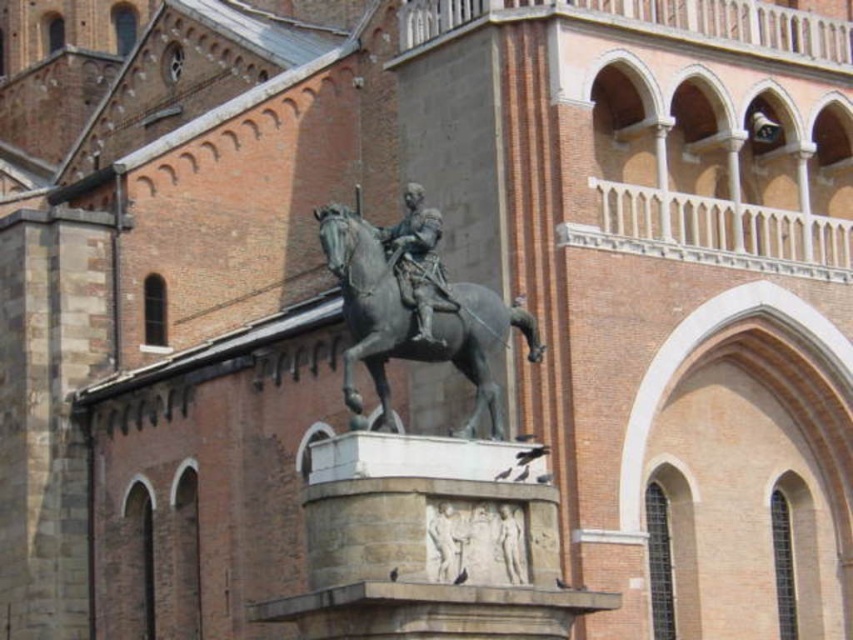
Question: Which object is closer to the camera taking this photo?

Choices:
 (A) polished bronze statue at center
 (B) bronze statue of horse at center

Answer: (B)

Question: Which point is farther to the camera?

Choices:
 (A) bronze statue of horse at center
 (B) polished bronze statue at center

Answer: (B)

Question: Is bronze statue of horse at center below polished bronze statue at center?

Choices:
 (A) yes
 (B) no

Answer: (A)

Question: Among these objects, which one is nearest to the camera?

Choices:
 (A) bronze statue of horse at center
 (B) polished bronze statue at center

Answer: (A)

Question: Can you confirm if bronze statue of horse at center is bigger than polished bronze statue at center?

Choices:
 (A) yes
 (B) no

Answer: (A)

Question: Does bronze statue of horse at center have a lesser width compared to polished bronze statue at center?

Choices:
 (A) no
 (B) yes

Answer: (A)